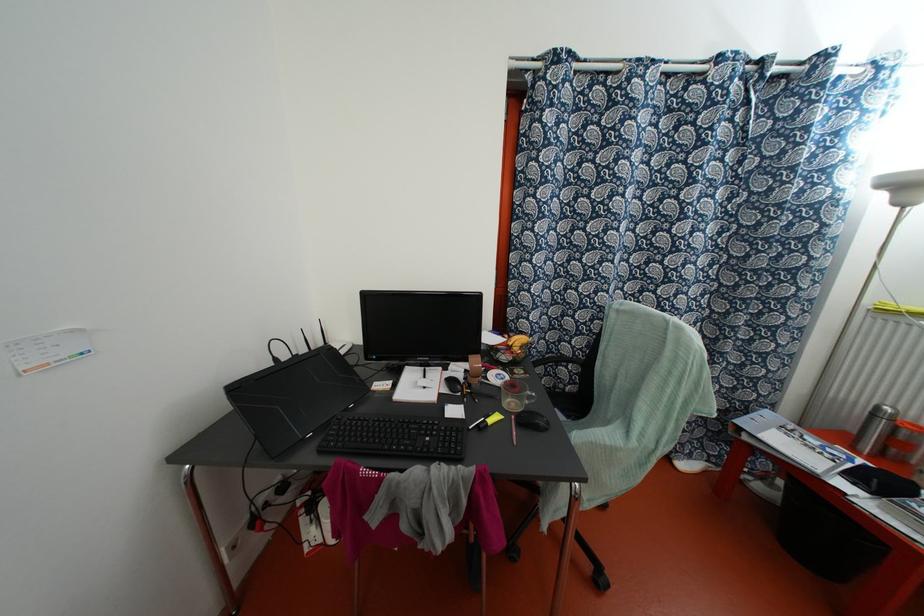
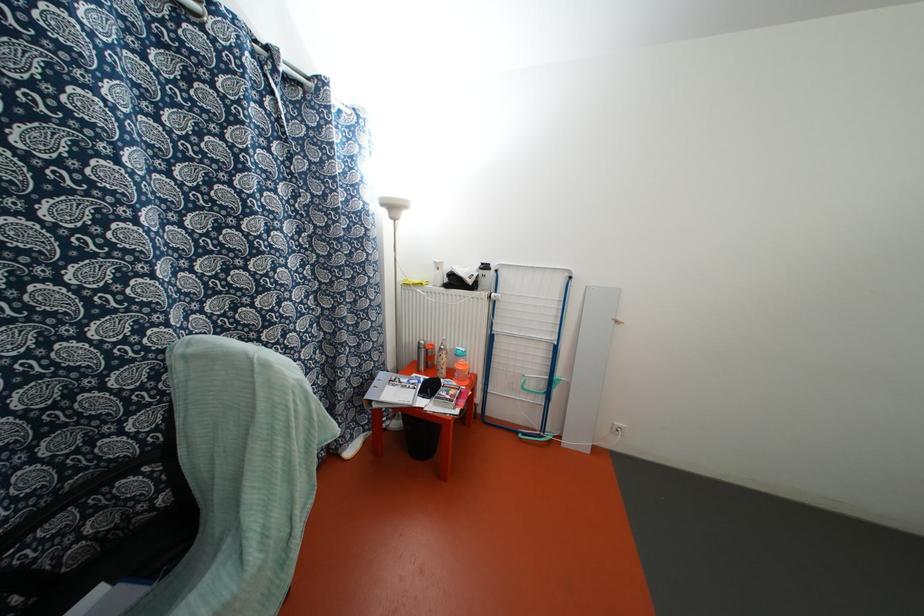
Question: The camera is either moving clockwise (left) or counter-clockwise (right) around the object. The first image is from the beginning of the video and the second image is from the end. Is the camera moving left or right when shooting the video?

Choices:
 (A) Left
 (B) Right

Answer: (A)